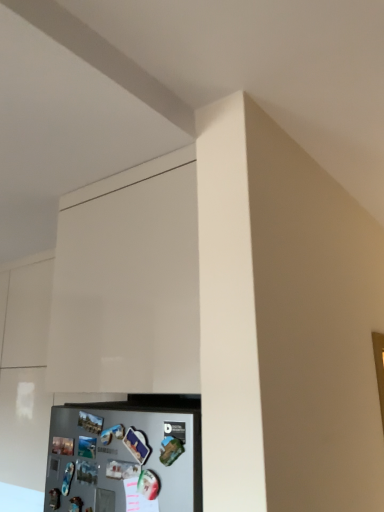
What do you see at coordinates (126, 455) in the screenshot? I see `satin silver refrigerator at lower left` at bounding box center [126, 455].

Where is `satin silver refrigerator at lower left`? This screenshot has width=384, height=512. satin silver refrigerator at lower left is located at coordinates pyautogui.click(x=126, y=455).

In order to face satin silver refrigerator at lower left, should I rotate leftwards or rightwards?

To align with it, rotate left about 11.190°.

This screenshot has height=512, width=384. I want to click on white glossy cabinet at upper center, so click(128, 283).

Describe the element at coordinates (128, 283) in the screenshot. I see `white glossy cabinet at upper center` at that location.

Locate an element on the screen. This screenshot has height=512, width=384. satin silver refrigerator at lower left is located at coordinates (126, 455).

Visually, is white glossy cabinet at upper center positioned to the left or to the right of satin silver refrigerator at lower left?

white glossy cabinet at upper center is to the right of satin silver refrigerator at lower left.

Is white glossy cabinet at upper center behind satin silver refrigerator at lower left?

Yes, white glossy cabinet at upper center is further from the viewer.

Considering the positions of points (148, 271) and (153, 451), is point (148, 271) closer to camera compared to point (153, 451)?

No, (148, 271) is behind (153, 451).

From the image's perspective, who appears lower, white glossy cabinet at upper center or satin silver refrigerator at lower left?

satin silver refrigerator at lower left is shown below in the image.

From a real-world perspective, relative to satin silver refrigerator at lower left, is white glossy cabinet at upper center vertically above or below?

From a real-world perspective, white glossy cabinet at upper center is physically above satin silver refrigerator at lower left.

Is white glossy cabinet at upper center wider than satin silver refrigerator at lower left?

Yes.

Between white glossy cabinet at upper center and satin silver refrigerator at lower left, which one has less height?

satin silver refrigerator at lower left.

Based on their sizes in the image, would you say white glossy cabinet at upper center is bigger or smaller than satin silver refrigerator at lower left?

Clearly, white glossy cabinet at upper center is larger in size than satin silver refrigerator at lower left.

Would you say white glossy cabinet at upper center contains satin silver refrigerator at lower left?

Definitely not — satin silver refrigerator at lower left is not inside white glossy cabinet at upper center.

Is white glossy cabinet at upper center in contact with satin silver refrigerator at lower left?

white glossy cabinet at upper center and satin silver refrigerator at lower left are not in contact.

Is white glossy cabinet at upper center turned away from satin silver refrigerator at lower left?

No, white glossy cabinet at upper center is not facing away from satin silver refrigerator at lower left.

How many degrees apart are the facing directions of white glossy cabinet at upper center and satin silver refrigerator at lower left?

The angle between the facing direction of white glossy cabinet at upper center and the facing direction of satin silver refrigerator at lower left is 2.37 degrees.

Where is `appliance that is below the white glossy cabinet at upper center (from the image's perspective)`? The image size is (384, 512). appliance that is below the white glossy cabinet at upper center (from the image's perspective) is located at coordinates [x=126, y=455].

Does satin silver refrigerator at lower left appear on the right side of white glossy cabinet at upper center?

No.

Is the depth of satin silver refrigerator at lower left greater than that of white glossy cabinet at upper center?

No, it is not.

Between point (94, 475) and point (151, 384), which one is positioned in front?

The point (151, 384) is closer.

From the image's perspective, does satin silver refrigerator at lower left appear higher than white glossy cabinet at upper center?

Actually, satin silver refrigerator at lower left appears below white glossy cabinet at upper center in the image.

From a real-world perspective, is satin silver refrigerator at lower left positioned above or below white glossy cabinet at upper center?

satin silver refrigerator at lower left is below white glossy cabinet at upper center.

In terms of width, does satin silver refrigerator at lower left look wider or thinner when compared to white glossy cabinet at upper center?

satin silver refrigerator at lower left is thinner than white glossy cabinet at upper center.

In terms of height, does satin silver refrigerator at lower left look taller or shorter compared to white glossy cabinet at upper center?

satin silver refrigerator at lower left is shorter than white glossy cabinet at upper center.

From the picture: Is satin silver refrigerator at lower left smaller than white glossy cabinet at upper center?

Yes.

Is satin silver refrigerator at lower left completely or partially outside of white glossy cabinet at upper center?

Indeed, satin silver refrigerator at lower left is completely outside white glossy cabinet at upper center.

Are satin silver refrigerator at lower left and white glossy cabinet at upper center located far from each other?

satin silver refrigerator at lower left is near white glossy cabinet at upper center, not far away.

Is satin silver refrigerator at lower left facing away from white glossy cabinet at upper center?

No.

Can you tell me how much satin silver refrigerator at lower left and white glossy cabinet at upper center differ in facing direction?

2.37 degrees separate the facing orientations of satin silver refrigerator at lower left and white glossy cabinet at upper center.

How much distance is there between satin silver refrigerator at lower left and white glossy cabinet at upper center?

They are 10.82 inches apart.

Identify the location of cabinetry above the satin silver refrigerator at lower left (from a real-world perspective). (128, 283).

Where is `appliance below the white glossy cabinet at upper center (from a real-world perspective)`? The image size is (384, 512). appliance below the white glossy cabinet at upper center (from a real-world perspective) is located at coordinates (126, 455).

The width and height of the screenshot is (384, 512). I want to click on cabinetry above the satin silver refrigerator at lower left (from a real-world perspective), so click(x=128, y=283).